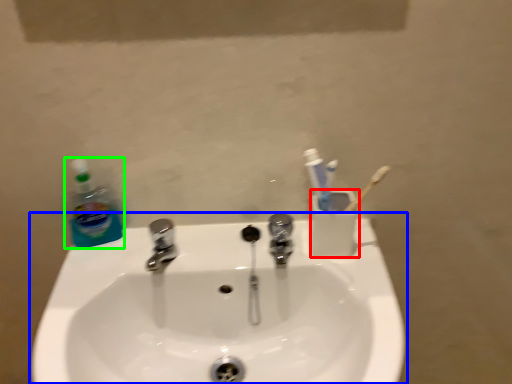
Question: Considering the real-world distances, which object is farthest from liquid (highlighted by a red box)? sink (highlighted by a blue box) or cleaning product (highlighted by a green box)?

Choices:
 (A) sink
 (B) cleaning product

Answer: (B)